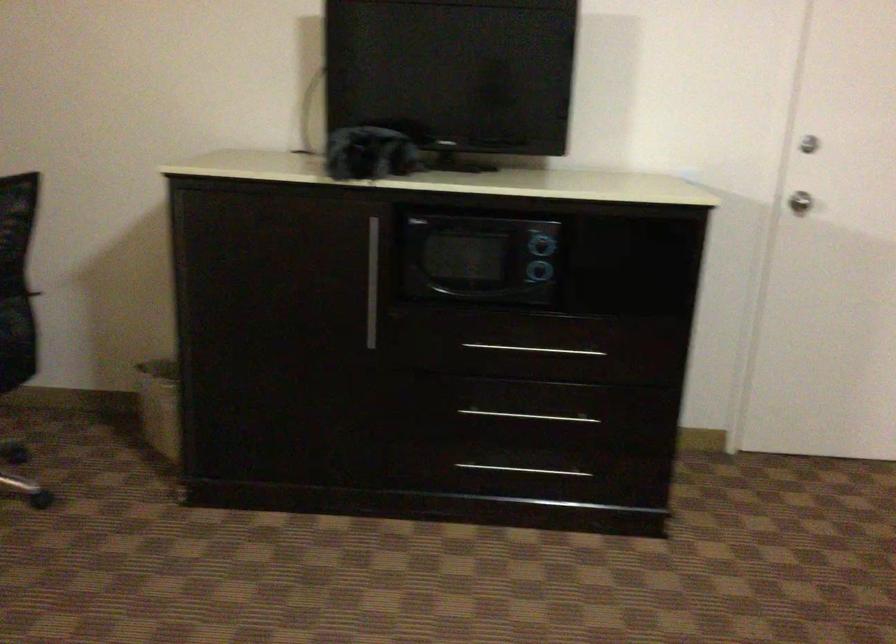
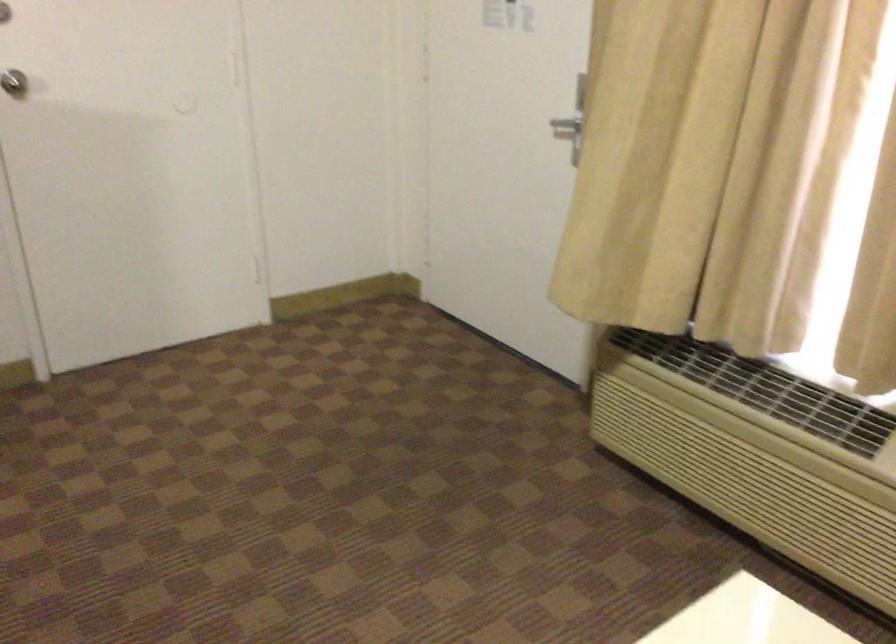
The point at (x=790, y=185) is marked in the first image. Where is the corresponding point in the second image?

(13, 82)